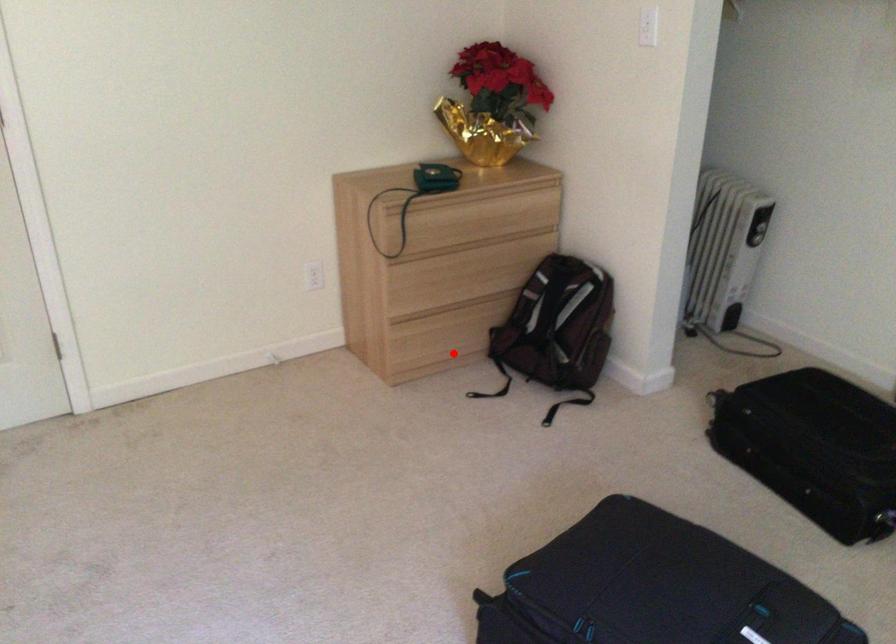
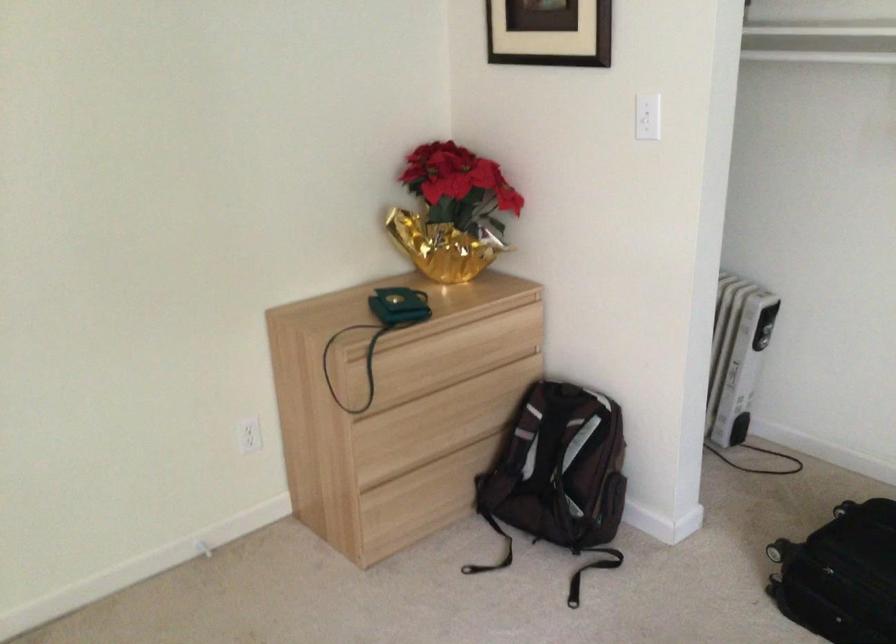
Question: A red point is marked in image1. In image2, is the corresponding 3D point closer to the camera or farther? Reply with the corresponding letter.

Choices:
 (A) The corresponding 3D point is closer.
 (B) The corresponding 3D point is farther.

Answer: (A)